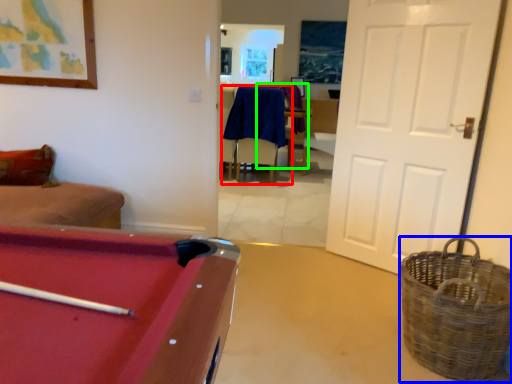
Question: Which is farther away from chair (highlighted by a red box)? basket (highlighted by a blue box) or armchair (highlighted by a green box)?

Choices:
 (A) basket
 (B) armchair

Answer: (A)